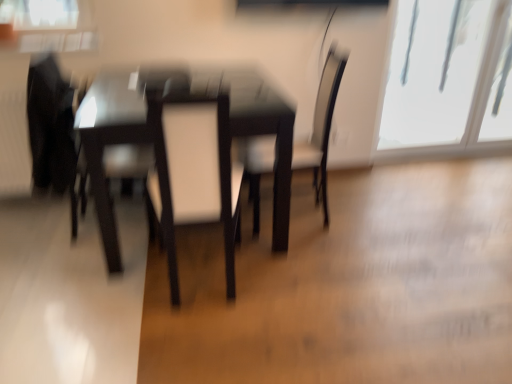
Where is `free space in front of white leather swivel chair at center, arranged as the first swivel chair when viewed from the right`? free space in front of white leather swivel chair at center, arranged as the first swivel chair when viewed from the right is located at coordinates click(190, 336).